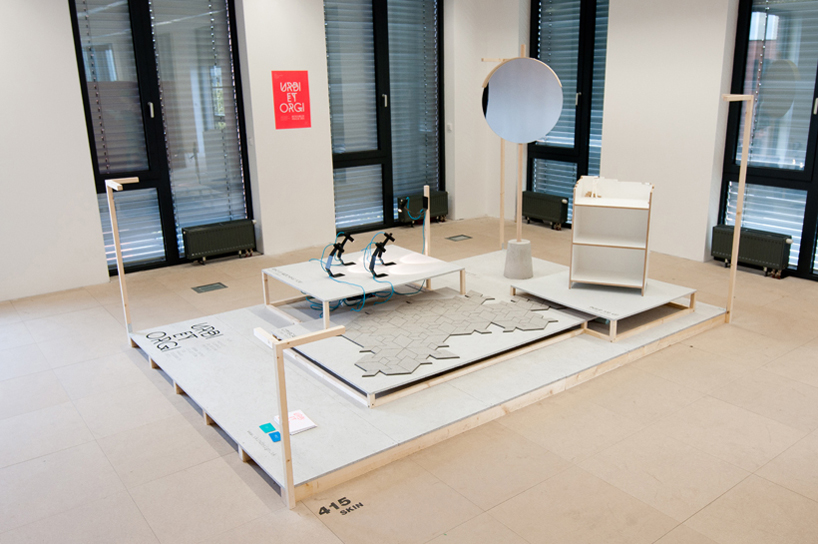
Image resolution: width=818 pixels, height=544 pixels. I want to click on black stands, so click(339, 246), click(378, 246).